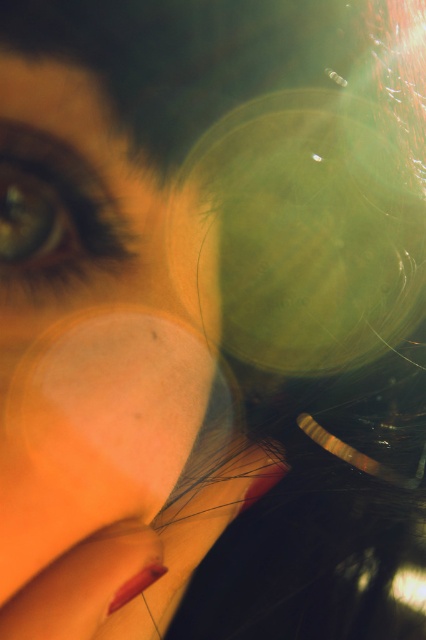
Who is shorter, matte skin at center or brown matte eye at upper left?

With less height is brown matte eye at upper left.

Is matte skin at center bigger than brown matte eye at upper left?

Correct, matte skin at center is larger in size than brown matte eye at upper left.

Between point (25, 540) and point (54, 232), which one is positioned in front?

Point (25, 540)

At what (x,y) coordinates should I click in order to perform the action: click on matte skin at center. Please return your answer as a coordinate pair (x, y). This screenshot has height=640, width=426. Looking at the image, I should click on (89, 340).

Can you confirm if smooth skin nose at lower left is shorter than brown matte eye at upper left?

In fact, smooth skin nose at lower left may be taller than brown matte eye at upper left.

You are a GUI agent. You are given a task and a screenshot of the screen. Output one action in this format:
    pyautogui.click(x=<x>, y=<y>)
    Task: Click on the smooth skin nose at lower left
    This screenshot has height=640, width=426.
    Given the screenshot: What is the action you would take?
    pyautogui.click(x=129, y=392)

The image size is (426, 640). I want to click on smooth skin nose at lower left, so click(129, 392).

Can you confirm if matte skin at center is positioned above smooth skin nose at lower left?

Yes, matte skin at center is above smooth skin nose at lower left.

Does point (127, 465) lie in front of point (143, 337)?

Yes, point (127, 465) is closer to viewer.

Identify the location of matte skin at center. The image size is (426, 640). (89, 340).